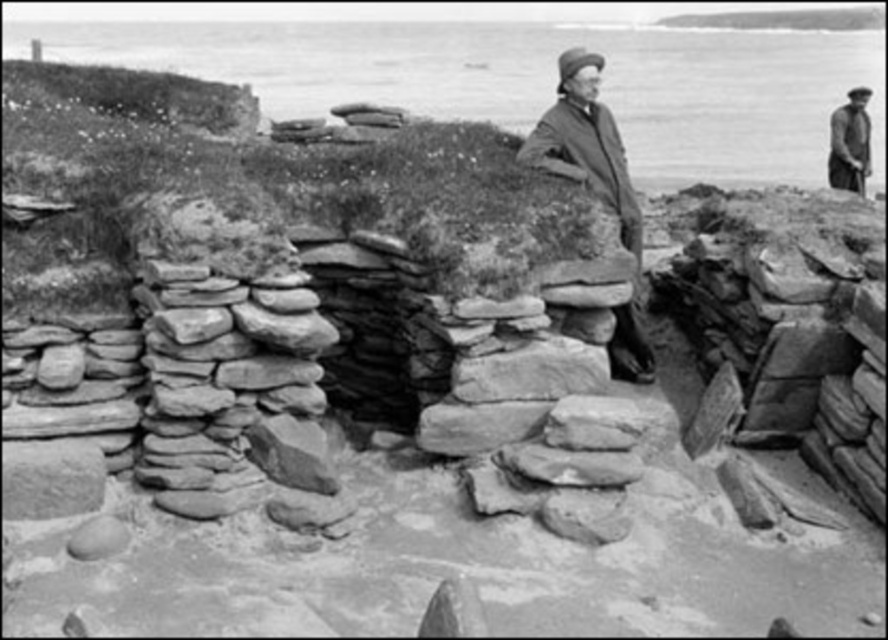
Is smooth rock at center above smooth dark fabric coat at upper right?

Actually, smooth rock at center is below smooth dark fabric coat at upper right.

Does smooth rock at center lie in front of smooth dark fabric coat at upper right?

Yes, smooth rock at center is closer to the viewer.

Who is more distant from viewer, (x=510, y=369) or (x=846, y=138)?

Positioned behind is point (x=846, y=138).

This screenshot has height=640, width=888. In order to click on smooth rock at center in this screenshot , I will do `click(532, 371)`.

Does smooth stone wall at center appear on the right side of smooth woolen coat at center?

No, smooth stone wall at center is not to the right of smooth woolen coat at center.

Does point (247, 353) lie behind point (628, 321)?

No, it is not.

Where is `smooth stone wall at center`? The image size is (888, 640). smooth stone wall at center is located at coordinates (231, 388).

Can you confirm if smooth stone wall at center is smaller than smooth rock at center?

Incorrect, smooth stone wall at center is not smaller in size than smooth rock at center.

Is smooth stone wall at center bigger than smooth rock at center?

Correct, smooth stone wall at center is larger in size than smooth rock at center.

Between point (176, 304) and point (525, 365), which one is positioned in front?

Point (176, 304)

Find the location of a particular element. This screenshot has height=640, width=888. smooth stone wall at center is located at coordinates (231, 388).